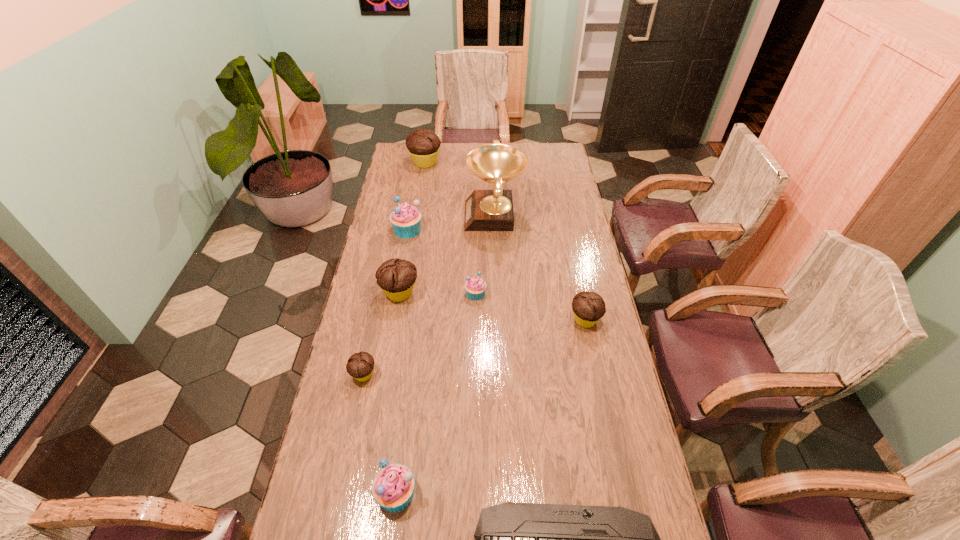
Find the location of a particular element. This screenshot has width=960, height=540. empty space between the third nearest object and the second smallest chocolate muffin is located at coordinates (474, 347).

This screenshot has width=960, height=540. Identify the location of empty space that is in between the second biggest blue muffin and the rightmost muffin. (491, 407).

I want to click on free space between the rightmost chocolate muffin and the second farthest muffin, so click(496, 275).

This screenshot has width=960, height=540. Find the location of `free space between the second biggest chocolate muffin and the award`. free space between the second biggest chocolate muffin and the award is located at coordinates (447, 255).

The height and width of the screenshot is (540, 960). I want to click on free space between the award and the third smallest chocolate muffin, so click(x=447, y=255).

This screenshot has height=540, width=960. In order to click on unoccupied position between the farthest object and the sixth nearest muffin in this screenshot , I will do `click(417, 196)`.

You are a GUI agent. You are given a task and a screenshot of the screen. Output one action in this format:
    pyautogui.click(x=<x>, y=<y>)
    Task: Click on the vacant space in between the biggest blue muffin and the second biggest blue muffin
    
    Given the screenshot: What is the action you would take?
    coord(402,361)

Identify which object is located as the second nearest to the rightmost chocolate muffin. Please provide its 2D coordinates. Your answer should be formatted as a tuple, i.e. [(x, y)], where the tuple contains the x and y coordinates of a point satisfying the conditions above.

[(485, 210)]

Identify which object is the closest to the computer keyboard. Please provide its 2D coordinates. Your answer should be formatted as a tuple, i.e. [(x, y)], where the tuple contains the x and y coordinates of a point satisfying the conditions above.

[(393, 487)]

Identify which muffin is the third nearest to the second biggest chocolate muffin. Please provide its 2D coordinates. Your answer should be formatted as a tuple, i.e. [(x, y)], where the tuple contains the x and y coordinates of a point satisfying the conditions above.

[(360, 365)]